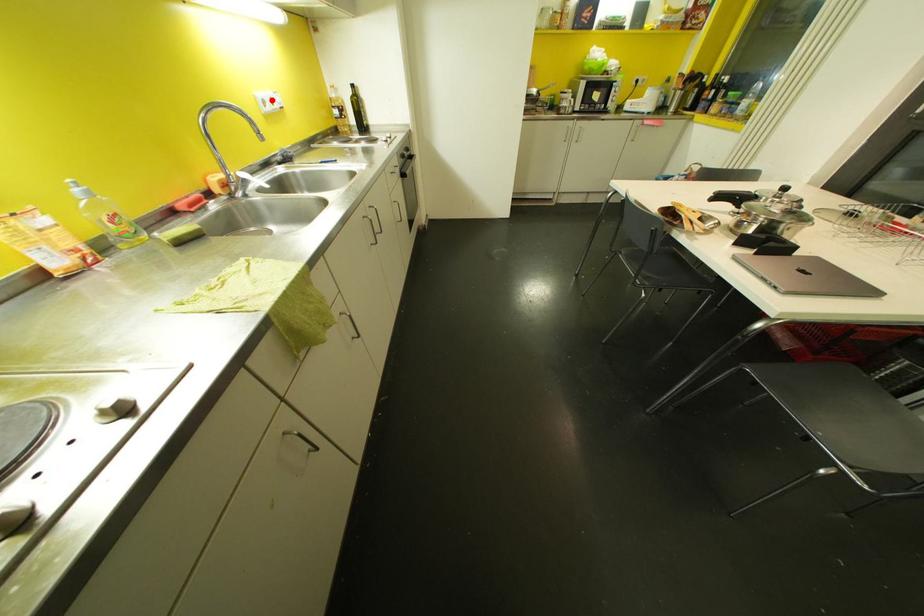
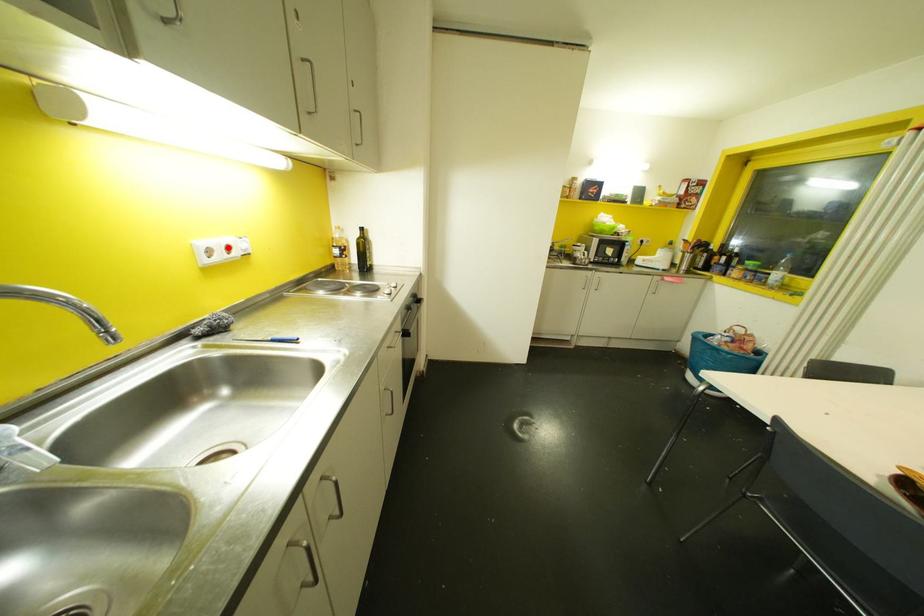
I am providing you with two images of the same scene from different viewpoints. A red point is marked on the first image and another point is marked on the second image. Is the red point in image1 aligned with the point shown in image2?

Yes